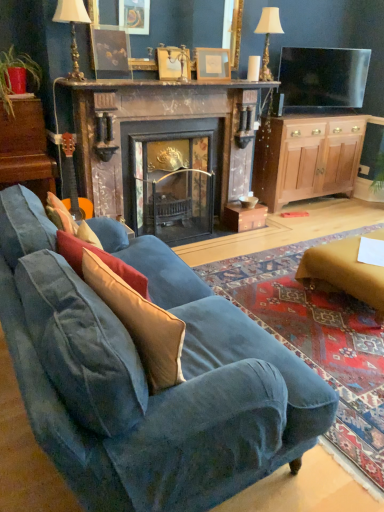
Question: Can you confirm if wooden dresser at left is bigger than matte gold picture frame at upper center, the second picture frame when ordered from left to right?

Choices:
 (A) no
 (B) yes

Answer: (B)

Question: Is wooden dresser at left located outside matte gold picture frame at upper center, which is the second picture frame in right-to-left order?

Choices:
 (A) yes
 (B) no

Answer: (A)

Question: Can you confirm if wooden dresser at left is thinner than matte gold picture frame at upper center, which is the second picture frame in right-to-left order?

Choices:
 (A) yes
 (B) no

Answer: (B)

Question: Would you consider wooden dresser at left to be distant from matte gold picture frame at upper center, the second picture frame when ordered from left to right?

Choices:
 (A) yes
 (B) no

Answer: (A)

Question: Is wooden dresser at left positioned before matte gold picture frame at upper center, the second picture frame when ordered from left to right?

Choices:
 (A) yes
 (B) no

Answer: (A)

Question: Considering the positions of point (359, 283) and point (107, 45), is point (359, 283) closer or farther from the camera than point (107, 45)?

Choices:
 (A) farther
 (B) closer

Answer: (B)

Question: Is matte gold ottoman at lower right taller or shorter than matte black picture frame at upper center, which is the third picture frame in right-to-left order?

Choices:
 (A) tall
 (B) short

Answer: (B)

Question: In the image, is matte gold ottoman at lower right on the left side or the right side of matte black picture frame at upper center, marked as the first picture frame in a left-to-right arrangement?

Choices:
 (A) left
 (B) right

Answer: (B)

Question: Considering their positions, is matte gold ottoman at lower right located in front of or behind matte black picture frame at upper center, which is the third picture frame in right-to-left order?

Choices:
 (A) behind
 (B) front

Answer: (B)

Question: In terms of size, does matte black picture frame at upper center, marked as the first picture frame in a left-to-right arrangement, appear bigger or smaller than velvet blue couch at lower left?

Choices:
 (A) small
 (B) big

Answer: (A)

Question: From the image's perspective, is matte black picture frame at upper center, which is the third picture frame in right-to-left order, above or below velvet blue couch at lower left?

Choices:
 (A) above
 (B) below

Answer: (A)

Question: Is point (117, 47) closer or farther from the camera than point (110, 423)?

Choices:
 (A) farther
 (B) closer

Answer: (A)

Question: Considering their positions, is matte black picture frame at upper center, marked as the first picture frame in a left-to-right arrangement, located in front of or behind velvet blue couch at lower left?

Choices:
 (A) behind
 (B) front

Answer: (A)

Question: From the image's perspective, relative to white fabric lampshade at upper center, the first lamp from the back, is wooden dresser at left above or below?

Choices:
 (A) below
 (B) above

Answer: (A)

Question: Relative to white fabric lampshade at upper center, placed as the first lamp when sorted from right to left, is wooden dresser at left in front or behind?

Choices:
 (A) front
 (B) behind

Answer: (A)